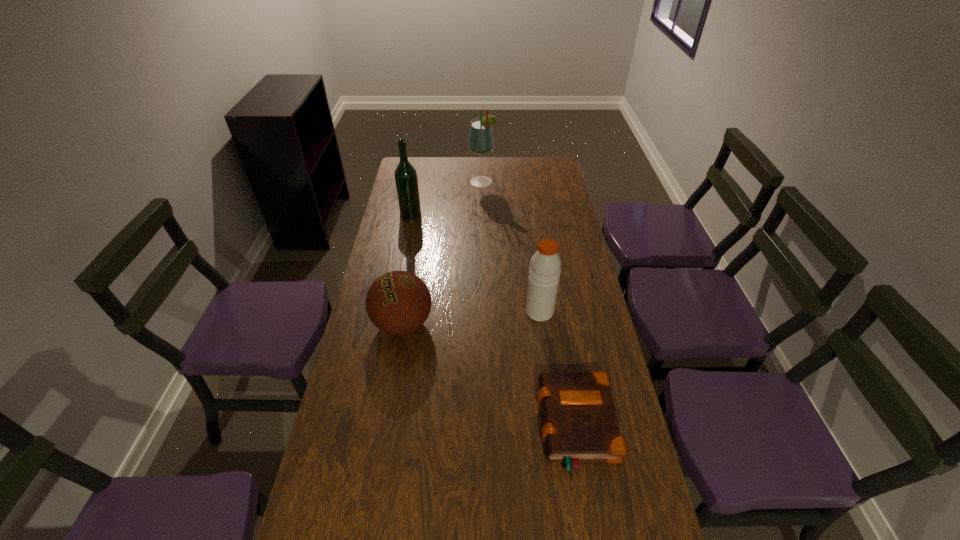
Locate an element on the screen. This screenshot has width=960, height=540. free space located on the left of the shaker is located at coordinates (442, 312).

What are the coordinates of `free space located on the right of the basketball` in the screenshot? It's located at [x=448, y=324].

Find the location of `vacant region located 0.120m on the spine side of the nearest object`. vacant region located 0.120m on the spine side of the nearest object is located at coordinates (494, 426).

Locate an element on the screen. vacant space located 0.140m on the spine side of the nearest object is located at coordinates (487, 426).

Find the location of a particular element. vacant region located 0.080m on the spine side of the nearest object is located at coordinates (510, 426).

The image size is (960, 540). I want to click on object that is at the far edge, so click(481, 140).

Locate an element on the screen. alcohol present at the left edge is located at coordinates coord(406,180).

Where is `basketball present at the left edge`? basketball present at the left edge is located at coordinates (398, 302).

Locate an element on the screen. This screenshot has width=960, height=540. shaker that is at the right edge is located at coordinates (545, 266).

Find the location of a particular element. The image size is (960, 540). Bible present at the right edge is located at coordinates (580, 424).